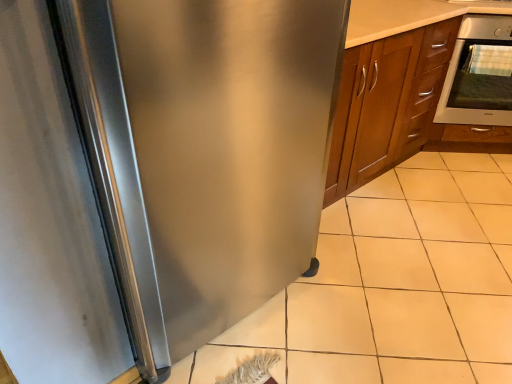
Question: Can you confirm if stainless steel refrigerator at left is positioned to the left of satin silver oven at upper right?

Choices:
 (A) no
 (B) yes

Answer: (B)

Question: From a real-world perspective, is stainless steel refrigerator at left below satin silver oven at upper right?

Choices:
 (A) no
 (B) yes

Answer: (A)

Question: Are stainless steel refrigerator at left and satin silver oven at upper right located far from each other?

Choices:
 (A) yes
 (B) no

Answer: (A)

Question: Is stainless steel refrigerator at left thinner than satin silver oven at upper right?

Choices:
 (A) no
 (B) yes

Answer: (A)

Question: Considering the relative sizes of stainless steel refrigerator at left and satin silver oven at upper right in the image provided, is stainless steel refrigerator at left smaller than satin silver oven at upper right?

Choices:
 (A) no
 (B) yes

Answer: (A)

Question: Considering the positions of satin silver oven at upper right and stainless steel refrigerator at left in the image, is satin silver oven at upper right wider or thinner than stainless steel refrigerator at left?

Choices:
 (A) thin
 (B) wide

Answer: (A)

Question: From a real-world perspective, is satin silver oven at upper right physically located above or below stainless steel refrigerator at left?

Choices:
 (A) above
 (B) below

Answer: (B)

Question: Is satin silver oven at upper right situated inside stainless steel refrigerator at left or outside?

Choices:
 (A) inside
 (B) outside

Answer: (B)

Question: Based on their sizes in the image, would you say satin silver oven at upper right is bigger or smaller than stainless steel refrigerator at left?

Choices:
 (A) small
 (B) big

Answer: (A)

Question: Is white tile at lower right bigger or smaller than satin silver oven at upper right?

Choices:
 (A) big
 (B) small

Answer: (A)

Question: Visually, is white tile at lower right positioned to the left or to the right of satin silver oven at upper right?

Choices:
 (A) left
 (B) right

Answer: (A)

Question: From a real-world perspective, is white tile at lower right positioned above or below satin silver oven at upper right?

Choices:
 (A) below
 (B) above

Answer: (A)

Question: Choose the correct answer: Is white tile at lower right inside satin silver oven at upper right or outside it?

Choices:
 (A) inside
 (B) outside

Answer: (B)

Question: From their relative heights in the image, would you say stainless steel refrigerator at left is taller or shorter than satin silver oven at upper right?

Choices:
 (A) tall
 (B) short

Answer: (A)

Question: Does point (17, 31) appear closer or farther from the camera than point (467, 16)?

Choices:
 (A) farther
 (B) closer

Answer: (B)